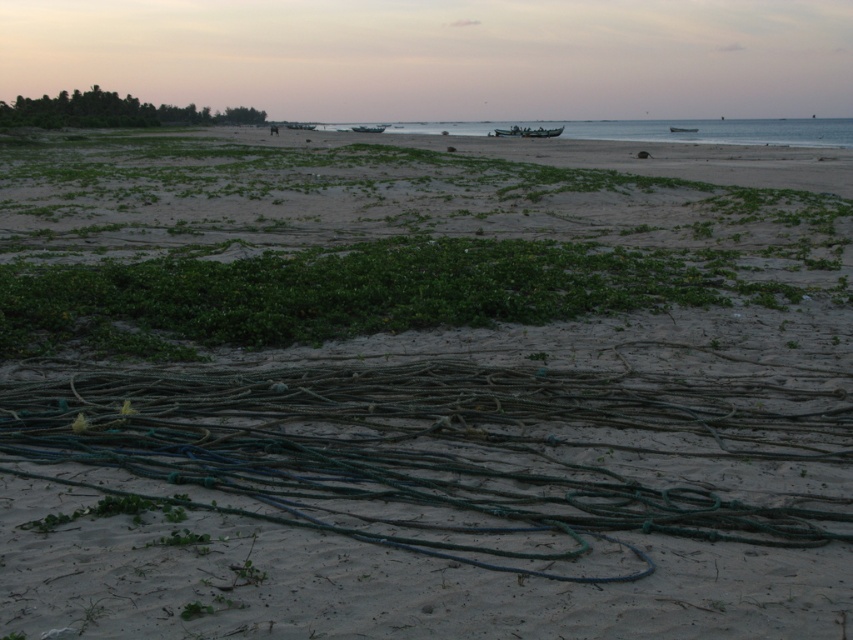
Question: Based on their relative distances, which object is nearer to the green rope net at center?

Choices:
 (A) green leafy vegetation at center
 (B) green plastic boat at center

Answer: (B)

Question: Which of these objects is positioned farthest from the green matte boat at center?

Choices:
 (A) green rubber rope at lower center
 (B) green leafy vegetation at upper left

Answer: (A)

Question: Which object is positioned closest to the green leafy vegetation at center?

Choices:
 (A) green rubber rope at lower center
 (B) clear blue water at center

Answer: (A)

Question: Does green plastic boat at center come behind green matte boat at center?

Choices:
 (A) yes
 (B) no

Answer: (B)

Question: Does green leafy vegetation at upper left have a lesser width compared to green plastic boat at center?

Choices:
 (A) yes
 (B) no

Answer: (B)

Question: Is green plastic boat at center wider than green rope net at center?

Choices:
 (A) no
 (B) yes

Answer: (B)